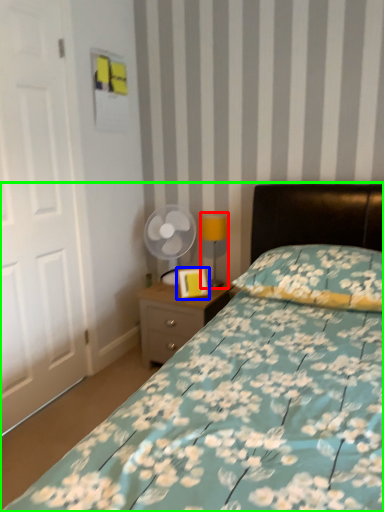
Question: Based on their relative distances, which object is farther from table lamp (highlighted by a red box)? Choose from picture frame (highlighted by a blue box) and bed (highlighted by a green box).

Choices:
 (A) picture frame
 (B) bed

Answer: (B)